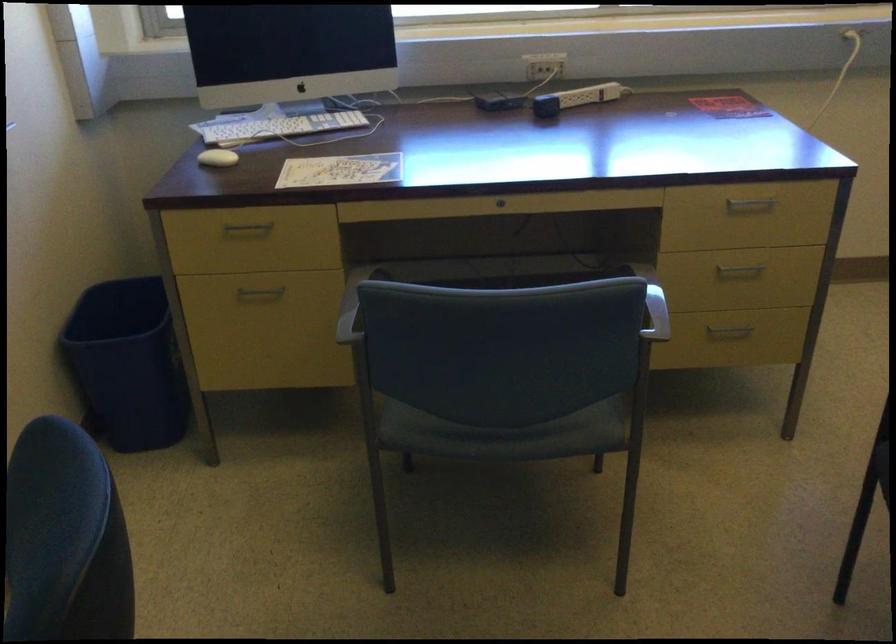
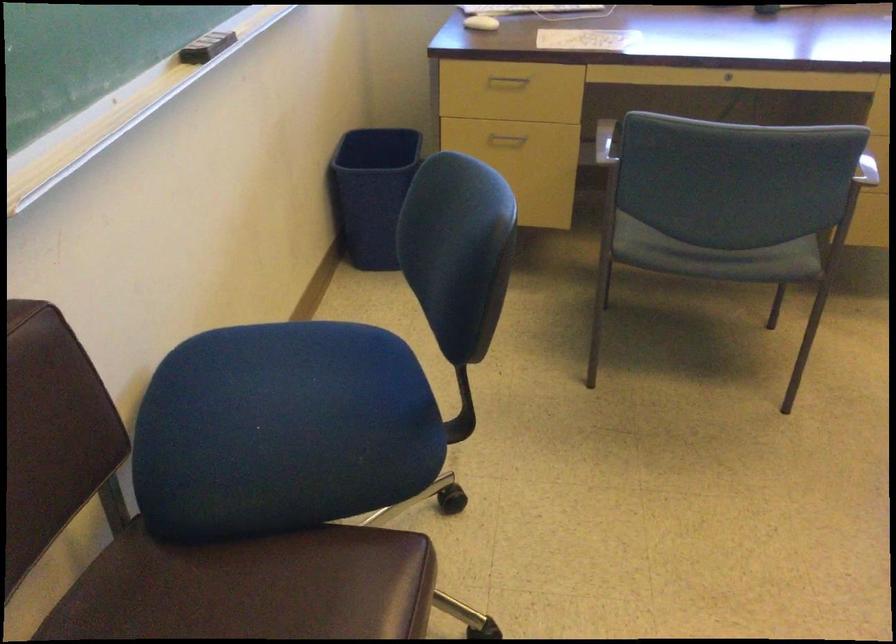
Question: The first image is from the beginning of the video and the second image is from the end. How did the camera likely rotate when shooting the video?

Choices:
 (A) Left
 (B) Right
 (C) Up
 (D) Down

Answer: (A)